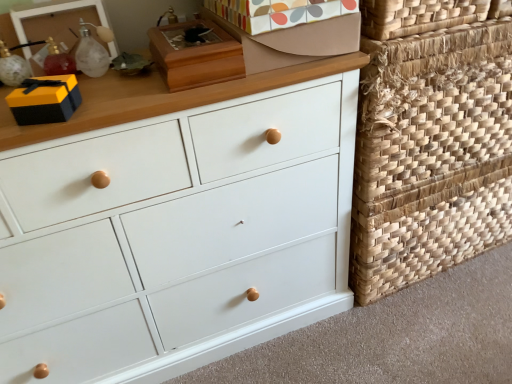
I want to click on translucent glass bottle at upper left, so click(x=92, y=51).

At what (x,y) coordinates should I click in order to perform the action: click on wooden shoe box at upper center, placed as the 1th shoe box when sorted from left to right. Please return your answer as a coordinate pair (x, y). Looking at the image, I should click on coord(195,56).

Identify the location of patterned cardboard shoe box at upper center, which is the first shoe box from right to left. This screenshot has height=384, width=512. (287, 38).

What do you see at coordinates (431, 154) in the screenshot? I see `natural woven basket at right, positioned as the 2th basket in bottom-to-top order` at bounding box center [431, 154].

This screenshot has height=384, width=512. I want to click on translucent glass bottle at upper left, so click(x=92, y=51).

Looking at this image, considering the relative sizes of matte black gift box at upper left and patterned cardboard shoe box at upper center, which ranks as the second shoe box in left-to-right order, in the image provided, is matte black gift box at upper left thinner than patterned cardboard shoe box at upper center, which ranks as the second shoe box in left-to-right order,?

Yes, matte black gift box at upper left is thinner than patterned cardboard shoe box at upper center, which ranks as the second shoe box in left-to-right order.

Is patterned cardboard shoe box at upper center, which is the first shoe box from right to left, at the back of matte black gift box at upper left?

No, matte black gift box at upper left is not facing away from patterned cardboard shoe box at upper center, which is the first shoe box from right to left.

Is point (42, 98) closer to viewer compared to point (249, 26)?

Yes, point (42, 98) is in front of point (249, 26).

Is matte black gift box at upper left far away from patterned cardboard shoe box at upper center, which ranks as the second shoe box in left-to-right order?

No, matte black gift box at upper left is in close proximity to patterned cardboard shoe box at upper center, which ranks as the second shoe box in left-to-right order.

From a real-world perspective, count 2nd baskets downward from the wooden shoe box at upper center, acting as the 2th shoe box starting from the right, and point to it. Please provide its 2D coordinates.

[(429, 228)]

Consider the image. Is natural woven basket at right, the 2th basket when ordered from top to bottom, thinner than wooden shoe box at upper center, placed as the 1th shoe box when sorted from left to right?

No, natural woven basket at right, the 2th basket when ordered from top to bottom, is not thinner than wooden shoe box at upper center, placed as the 1th shoe box when sorted from left to right.

Is natural woven basket at right, which is the first basket in bottom-to-top order, aimed at patterned cardboard shoe box at upper center, which is the first shoe box from right to left?

No, natural woven basket at right, which is the first basket in bottom-to-top order, is not turned towards patterned cardboard shoe box at upper center, which is the first shoe box from right to left.

Can you tell me how much natural woven basket at right, the 2th basket when ordered from top to bottom, and patterned cardboard shoe box at upper center, which is the first shoe box from right to left, differ in facing direction?

4.16 degrees separate the facing orientations of natural woven basket at right, the 2th basket when ordered from top to bottom, and patterned cardboard shoe box at upper center, which is the first shoe box from right to left.

Measure the distance between natural woven basket at right, the 2th basket when ordered from top to bottom, and patterned cardboard shoe box at upper center, which is the first shoe box from right to left.

The distance of natural woven basket at right, the 2th basket when ordered from top to bottom, from patterned cardboard shoe box at upper center, which is the first shoe box from right to left, is 26.49 inches.

Which point is more distant from viewer, (399,260) or (337,18)?

The point (399,260) is farther from the camera.

Would you consider white matte chest of drawers at center to be distant from translucent glass bottle at upper left?

white matte chest of drawers at center is actually quite close to translucent glass bottle at upper left.

Considering the sizes of white matte chest of drawers at center and translucent glass bottle at upper left in the image, is white matte chest of drawers at center bigger or smaller than translucent glass bottle at upper left?

white matte chest of drawers at center is bigger than translucent glass bottle at upper left.

Between white matte chest of drawers at center and translucent glass bottle at upper left, which one has more height?

Standing taller between the two is white matte chest of drawers at center.

Does point (288, 142) lie behind point (77, 66)?

No, (288, 142) is closer to viewer.

Which is more to the right, matte black gift box at upper left or white matte chest of drawers at center?

Positioned to the right is white matte chest of drawers at center.

Is matte black gift box at upper left positioned behind white matte chest of drawers at center?

Yes, it is behind white matte chest of drawers at center.

This screenshot has height=384, width=512. What are the coordinates of `storage box that appears above the white matte chest of drawers at center (from the image's perspective)` in the screenshot? It's located at (45, 100).

Choose the correct answer: Is matte black gift box at upper left inside white matte chest of drawers at center or outside it?

matte black gift box at upper left is located beyond the bounds of white matte chest of drawers at center.

Is wooden shoe box at upper center, placed as the 1th shoe box when sorted from left to right, to the left or to the right of natural woven basket at right, positioned as the 1th basket in top-to-bottom order, in the image?

Clearly, wooden shoe box at upper center, placed as the 1th shoe box when sorted from left to right, is on the left of natural woven basket at right, positioned as the 1th basket in top-to-bottom order, in the image.

Between wooden shoe box at upper center, acting as the 2th shoe box starting from the right, and natural woven basket at right, positioned as the 2th basket in bottom-to-top order, which one is positioned in front?

wooden shoe box at upper center, acting as the 2th shoe box starting from the right.

Between wooden shoe box at upper center, placed as the 1th shoe box when sorted from left to right, and natural woven basket at right, positioned as the 2th basket in bottom-to-top order, which one has larger size?

Bigger between the two is natural woven basket at right, positioned as the 2th basket in bottom-to-top order.

How far apart are patterned cardboard shoe box at upper center, which ranks as the second shoe box in left-to-right order, and matte black gift box at upper left?

The distance of patterned cardboard shoe box at upper center, which ranks as the second shoe box in left-to-right order, from matte black gift box at upper left is 18.10 inches.

From the image's perspective, is patterned cardboard shoe box at upper center, which ranks as the second shoe box in left-to-right order, above or below matte black gift box at upper left?

patterned cardboard shoe box at upper center, which ranks as the second shoe box in left-to-right order, is situated higher than matte black gift box at upper left in the image.

Could matte black gift box at upper left be considered to be inside patterned cardboard shoe box at upper center, which is the first shoe box from right to left?

No, patterned cardboard shoe box at upper center, which is the first shoe box from right to left, does not contain matte black gift box at upper left.

Is patterned cardboard shoe box at upper center, which ranks as the second shoe box in left-to-right order, far from matte black gift box at upper left?

patterned cardboard shoe box at upper center, which ranks as the second shoe box in left-to-right order, is actually quite close to matte black gift box at upper left.

At what (x,y) coordinates should I click in order to perform the action: click on storage box located above the patterned cardboard shoe box at upper center, which is the first shoe box from right to left (from a real-world perspective). Please return your answer as a coordinate pair (x, y). The image size is (512, 384). Looking at the image, I should click on (45, 100).

What are the coordinates of `the 2nd basket below the wooden shoe box at upper center, placed as the 1th shoe box when sorted from left to right (from the image's perspective)` in the screenshot? It's located at (429, 228).

Looking at the image, which one is located closer to natural woven basket at right, the 2th basket when ordered from top to bottom, natural woven basket at right, positioned as the 2th basket in bottom-to-top order, or white matte chest of drawers at center?

Based on the image, natural woven basket at right, positioned as the 2th basket in bottom-to-top order, appears to be nearer to natural woven basket at right, the 2th basket when ordered from top to bottom.

Based on their spatial positions, is translucent glass bottle at upper left or patterned cardboard shoe box at upper center, which is the first shoe box from right to left, closer to wooden shoe box at upper center, acting as the 2th shoe box starting from the right?

patterned cardboard shoe box at upper center, which is the first shoe box from right to left.

Looking at the image, which one is located further to natural woven basket at right, positioned as the 1th basket in top-to-bottom order, natural woven basket at right, which is the first basket in bottom-to-top order, or matte black gift box at upper left?

matte black gift box at upper left is positioned further to the anchor natural woven basket at right, positioned as the 1th basket in top-to-bottom order.

Looking at the image, which one is located closer to natural woven basket at right, positioned as the 2th basket in bottom-to-top order, natural woven basket at right, the 2th basket when ordered from top to bottom, or white matte chest of drawers at center?

The object closer to natural woven basket at right, positioned as the 2th basket in bottom-to-top order, is natural woven basket at right, the 2th basket when ordered from top to bottom.

Which object lies nearer to the anchor point matte black gift box at upper left, white matte chest of drawers at center or natural woven basket at right, positioned as the 1th basket in top-to-bottom order?

Based on the image, white matte chest of drawers at center appears to be nearer to matte black gift box at upper left.

When comparing their distances from wooden shoe box at upper center, placed as the 1th shoe box when sorted from left to right, does matte black gift box at upper left or patterned cardboard shoe box at upper center, which is the first shoe box from right to left, seem further?

matte black gift box at upper left lies further to wooden shoe box at upper center, placed as the 1th shoe box when sorted from left to right, than the other object.

From the image, which object appears to be nearer to translucent glass bottle at upper left, natural woven basket at right, which is the first basket in bottom-to-top order, or white matte chest of drawers at center?

white matte chest of drawers at center is positioned closer to the anchor translucent glass bottle at upper left.

Consider the image. Considering their positions, is wooden shoe box at upper center, acting as the 2th shoe box starting from the right, positioned further to translucent glass bottle at upper left than patterned cardboard shoe box at upper center, which is the first shoe box from right to left?

The object further to translucent glass bottle at upper left is patterned cardboard shoe box at upper center, which is the first shoe box from right to left.

Where is `toy between matte black gift box at upper left and natural woven basket at right, the 2th basket when ordered from top to bottom`? This screenshot has width=512, height=384. toy between matte black gift box at upper left and natural woven basket at right, the 2th basket when ordered from top to bottom is located at coordinates (92, 51).

At what (x,y) coordinates should I click in order to perform the action: click on toy between wooden shoe box at upper center, placed as the 1th shoe box when sorted from left to right, and white matte chest of drawers at center, in the vertical direction. Please return your answer as a coordinate pair (x, y). Looking at the image, I should click on (92, 51).

Where is `shoe box that lies between patterned cardboard shoe box at upper center, which ranks as the second shoe box in left-to-right order, and white matte chest of drawers at center from top to bottom`? The image size is (512, 384). shoe box that lies between patterned cardboard shoe box at upper center, which ranks as the second shoe box in left-to-right order, and white matte chest of drawers at center from top to bottom is located at coordinates (195, 56).

Identify the location of storage box between patterned cardboard shoe box at upper center, which is the first shoe box from right to left, and white matte chest of drawers at center in the up-down direction. The width and height of the screenshot is (512, 384). (45, 100).